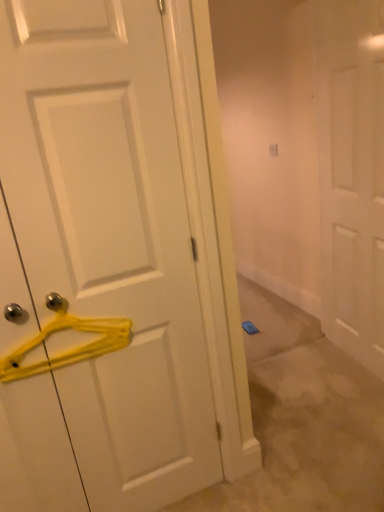
Question: Would you consider yellow plastic hanger at left to be distant from white matte door at left, which is counted as the first door, starting from the left?

Choices:
 (A) no
 (B) yes

Answer: (A)

Question: From a real-world perspective, is yellow plastic hanger at left beneath white matte door at left, acting as the 1th door starting from the front?

Choices:
 (A) no
 (B) yes

Answer: (B)

Question: Does yellow plastic hanger at left have a lesser height compared to white matte door at left, which appears as the 2th door when viewed from the back?

Choices:
 (A) no
 (B) yes

Answer: (B)

Question: From the image's perspective, would you say yellow plastic hanger at left is positioned over white matte door at left, acting as the 1th door starting from the front?

Choices:
 (A) yes
 (B) no

Answer: (B)

Question: Can you confirm if yellow plastic hanger at left is smaller than white matte door at left, which is counted as the first door, starting from the left?

Choices:
 (A) yes
 (B) no

Answer: (A)

Question: Does yellow plastic hanger at left have a lesser width compared to white matte door at left, the second door positioned from the right?

Choices:
 (A) no
 (B) yes

Answer: (B)

Question: From a real-world perspective, is yellow plastic hanger at left beneath white matte door at center, the first door positioned from the back?

Choices:
 (A) yes
 (B) no

Answer: (A)

Question: Is yellow plastic hanger at left not close to white matte door at center, the 2th door viewed from the front?

Choices:
 (A) yes
 (B) no

Answer: (A)

Question: Is yellow plastic hanger at left shorter than white matte door at center, the 1th door from the right?

Choices:
 (A) yes
 (B) no

Answer: (A)

Question: Are yellow plastic hanger at left and white matte door at center, which is the second door in left-to-right order, beside each other?

Choices:
 (A) no
 (B) yes

Answer: (A)

Question: Does yellow plastic hanger at left have a greater height compared to white matte door at center, which is the second door in left-to-right order?

Choices:
 (A) no
 (B) yes

Answer: (A)

Question: Can you confirm if yellow plastic hanger at left is positioned to the left of white matte door at center, the 2th door viewed from the front?

Choices:
 (A) yes
 (B) no

Answer: (A)

Question: Can you confirm if white matte door at center, the first door positioned from the back, is smaller than white matte door at left, which appears as the 2th door when viewed from the back?

Choices:
 (A) yes
 (B) no

Answer: (B)